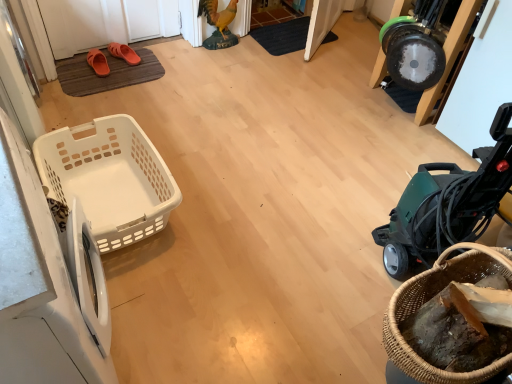
This screenshot has height=384, width=512. I want to click on vacant area located to the right-hand side of orange rubber sandals at upper left, acting as the 2th footwear starting from the left, so click(x=146, y=64).